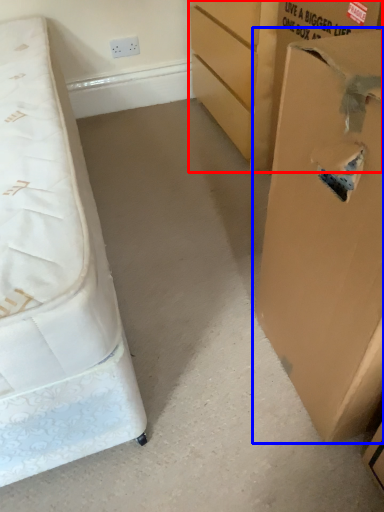
Question: Which object appears farthest to the camera in this image, cardboard box (highlighted by a red box) or cardboard box (highlighted by a blue box)?

Choices:
 (A) cardboard box
 (B) cardboard box

Answer: (A)